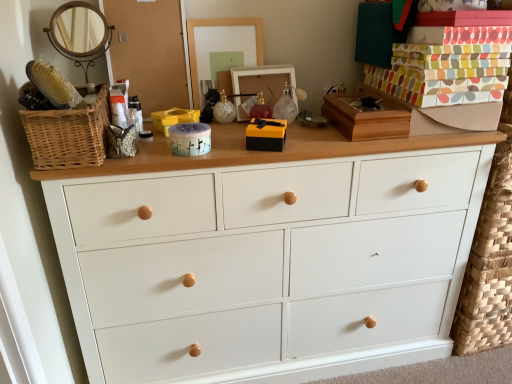
Find the location of a particular element. The image size is (512, 384). vacant area that is situated to the right of matte purple container at center, positioned as the third box in right-to-left order is located at coordinates (242, 153).